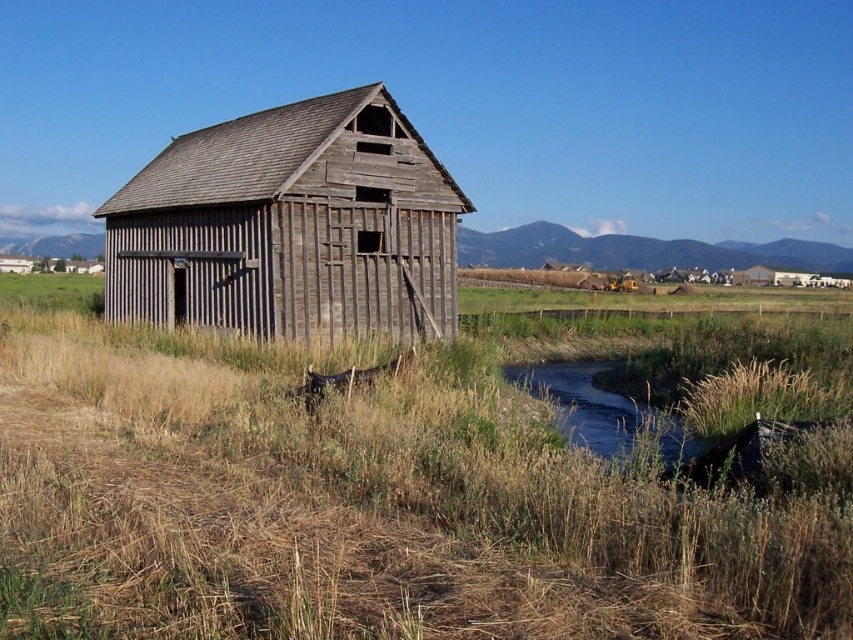
Question: Which of the following is the closest to the observer?

Choices:
 (A) dry grass at center
 (B) green grassy creek at lower center
 (C) weathered wood barn at center

Answer: (A)

Question: Which of the following is the farthest from the observer?

Choices:
 (A) (264, 195)
 (B) (509, 378)

Answer: (B)

Question: Which object appears closest to the camera in this image?

Choices:
 (A) weathered wood barn at center
 (B) green grassy creek at lower center

Answer: (B)

Question: Does weathered wood barn at center appear on the right side of green grassy creek at lower center?

Choices:
 (A) yes
 (B) no

Answer: (B)

Question: Is the position of dry grass at center more distant than that of green grassy creek at lower center?

Choices:
 (A) yes
 (B) no

Answer: (B)

Question: Does dry grass at center have a larger size compared to weathered wood barn at center?

Choices:
 (A) no
 (B) yes

Answer: (A)